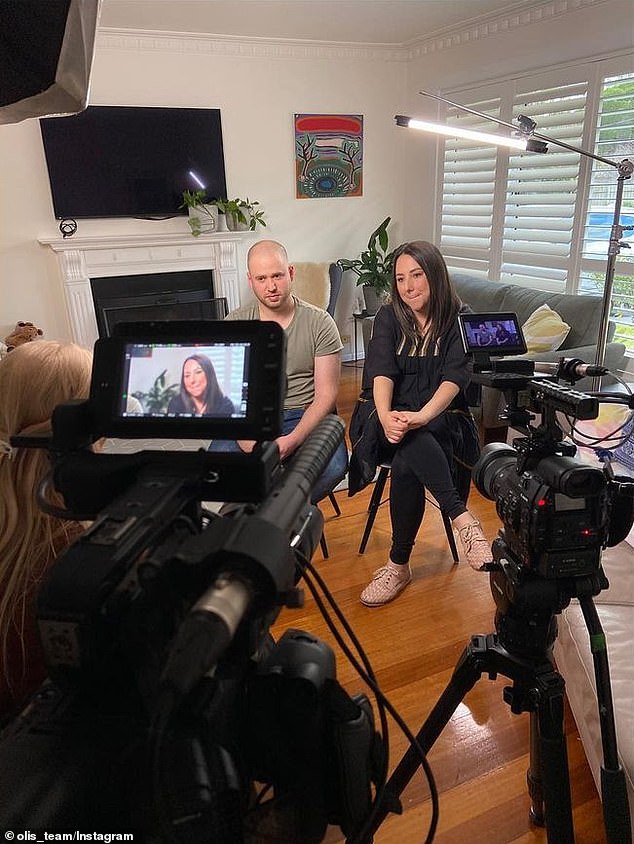
Image resolution: width=634 pixels, height=844 pixels. Find the location of `lamp`. lamp is located at coordinates (453, 127).